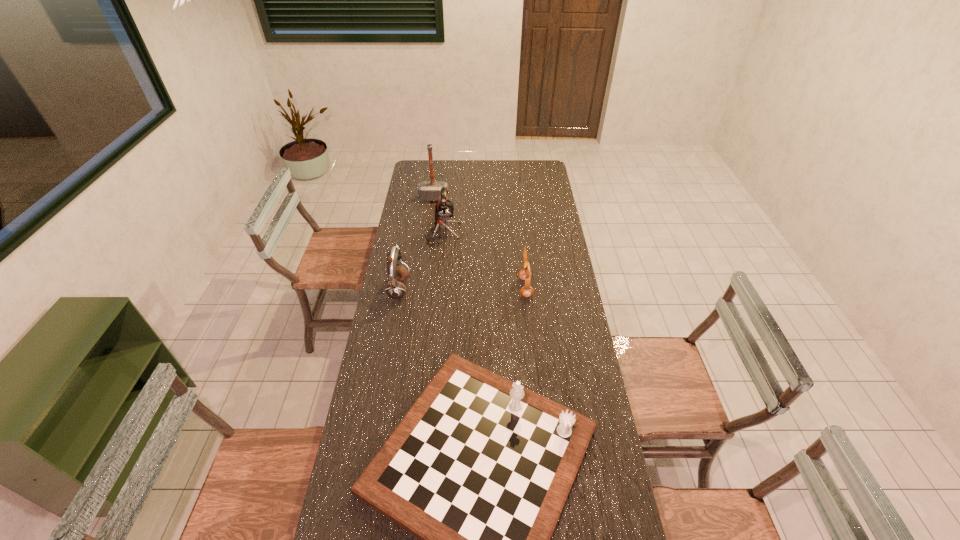
At what (x,y) coordinates should I click in order to perform the action: click on free spot located 0.370m on the front-facing side of the rightmost earphone. Please return your answer as a coordinate pair (x, y). The height and width of the screenshot is (540, 960). Looking at the image, I should click on (430, 288).

Locate an element on the screen. vacant space located 0.100m on the front-facing side of the rightmost earphone is located at coordinates (494, 288).

Where is `hammer that is positioned at the left edge`? The height and width of the screenshot is (540, 960). hammer that is positioned at the left edge is located at coordinates (428, 190).

Where is `blank space at the far edge of the desktop`? blank space at the far edge of the desktop is located at coordinates (512, 171).

In the image, there is a desktop. Where is `vacant space at the left edge`? The height and width of the screenshot is (540, 960). vacant space at the left edge is located at coordinates (376, 338).

I want to click on vacant space at the right edge, so click(563, 322).

This screenshot has height=540, width=960. In the image, there is a desktop. Identify the location of vacant space at the far right corner. (522, 167).

Find the location of a particular element. This screenshot has width=960, height=540. vacant area that lies between the rightmost earphone and the leftmost earphone is located at coordinates (462, 288).

I want to click on free space that is in between the second earphone from right to left and the leftmost earphone, so click(x=420, y=261).

At what (x,y) coordinates should I click in order to perform the action: click on vacant area that lies between the rightmost earphone and the farthest object. Please return your answer as a coordinate pair (x, y). Looking at the image, I should click on (480, 243).